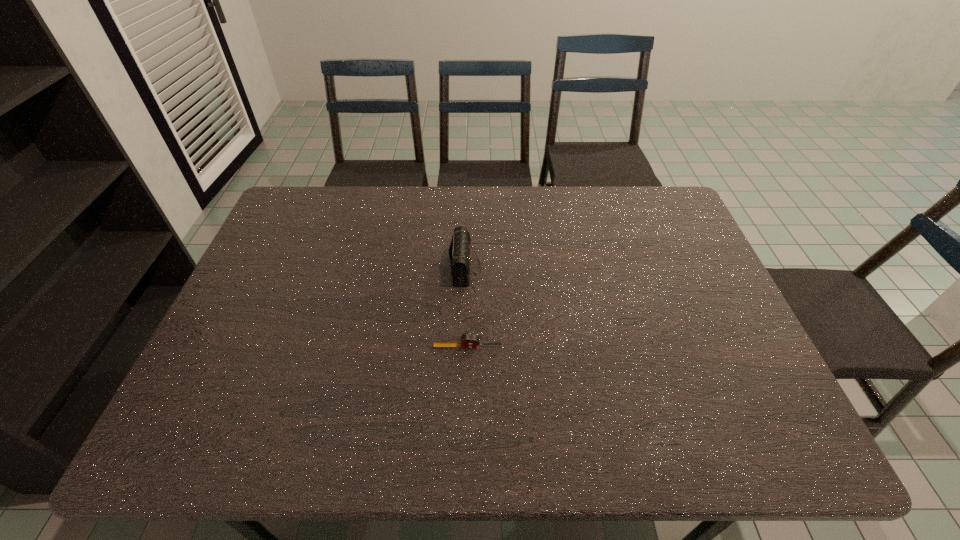
Where is `clutch bag`? clutch bag is located at coordinates (459, 251).

Where is `the taller object`? The image size is (960, 540). the taller object is located at coordinates (459, 251).

Where is `the shorter object`? The width and height of the screenshot is (960, 540). the shorter object is located at coordinates (468, 341).

Find the location of a particular element. Image resolution: width=960 pixels, height=540 pixels. tape measure is located at coordinates (468, 341).

Locate an element on the screen. The image size is (960, 540). vacant area located on the front flap of the taller object is located at coordinates (498, 268).

Identify the location of vacant space located 0.310m on the back of the shorter object. (469, 258).

The image size is (960, 540). What are the coordinates of `blank space at the far edge of the desktop` in the screenshot? It's located at (576, 210).

Identify the location of vacant space at the near edge of the desktop. This screenshot has width=960, height=540. (347, 435).

You are a GUI agent. You are given a task and a screenshot of the screen. Output one action in this format:
    pyautogui.click(x=<x>, y=<y>)
    Task: Click on the vacant point at the left edge
    The height and width of the screenshot is (540, 960).
    Given the screenshot: What is the action you would take?
    pyautogui.click(x=256, y=362)

The image size is (960, 540). Find the location of `free space at the right edge`. free space at the right edge is located at coordinates (752, 389).